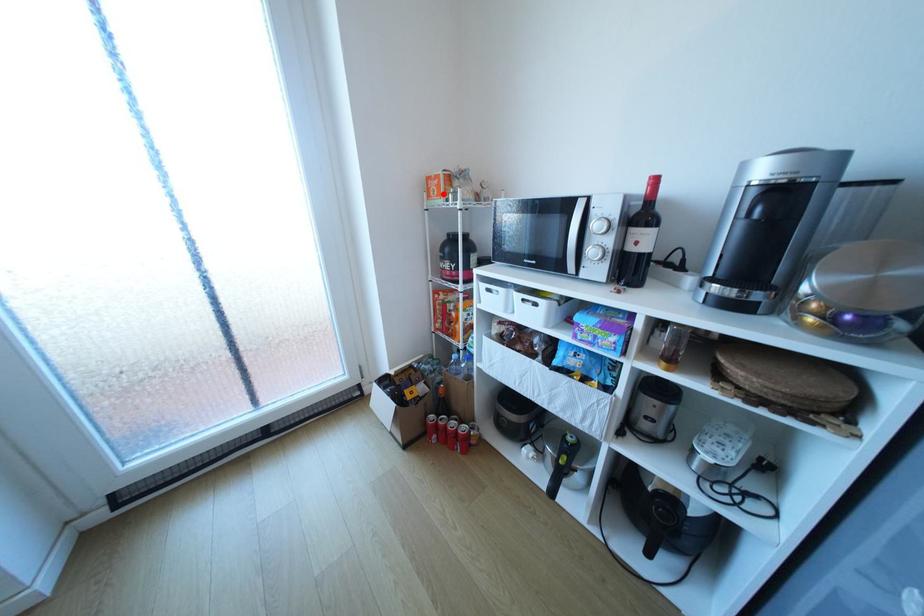
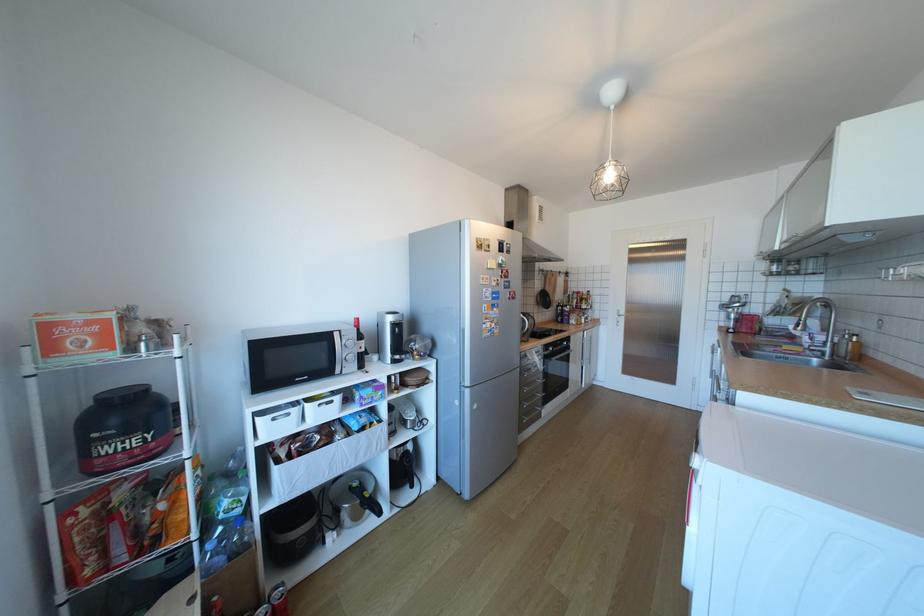
Question: I am providing you with two images of the same scene from different viewpoints. A red point is marked on the first image. Is the red point's position out of view in image 2?

Choices:
 (A) Yes
 (B) No

Answer: (B)